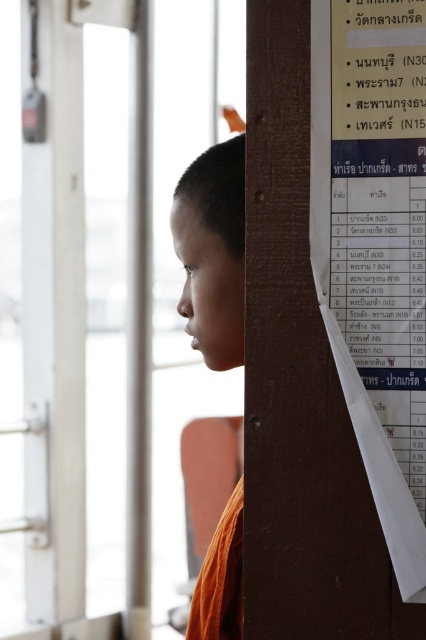
You are standing in a temple and see the white paper at right and the orange cloth at lower right. Which object is positioned higher in the scene?

The white paper at right is above the orange cloth at lower right, so the white paper at right is positioned higher in the scene.

You are a traveler who needs to read the schedule on the white paper at right. The orange cloth at lower right is blocking part of the paper. Can you tell me which object is taller so you can move the shorter one to access the schedule?

The white paper at right is taller than the orange cloth at lower right. Therefore, the orange cloth at lower right is shorter and can be moved to access the schedule.

You are a delivery robot with a 12 inch wide package. You need to move from the orange cloth at lower right to the white paper at right. Is there enough space between them for your package?

The distance between the white paper at right and orange cloth at lower right is 18.38 inches, which is wider than the 12 inch package. Yes, there is enough space.